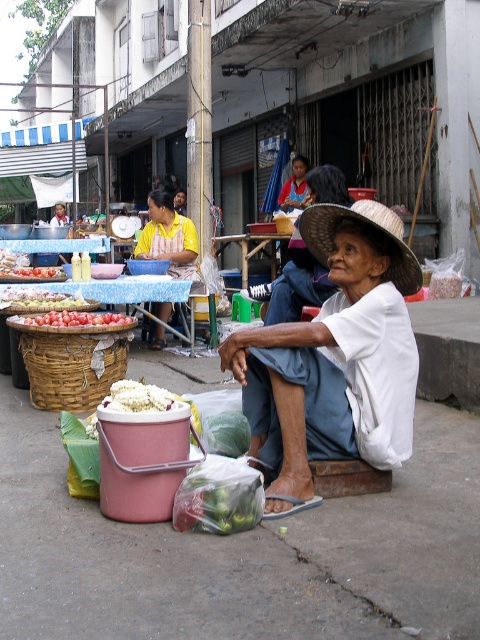
Question: Which of the following is the farthest from the observer?

Choices:
 (A) white cotton hat at center
 (B) woven brown basket at lower left
 (C) strawmaterial/texturehat at center

Answer: (B)

Question: Considering the real-world distances, which object is closest to the strawmaterial/texturehat at center?

Choices:
 (A) yellow fabric apron at center
 (B) pink plastic bucket at lower center
 (C) woven brown basket at lower left

Answer: (B)

Question: Which of the following is the farthest from the observer?

Choices:
 (A) (79, 404)
 (B) (343, 333)
 (C) (148, 209)
 (D) (400, 240)

Answer: (C)

Question: Does white cotton hat at center have a smaller size compared to strawmaterial/texturehat at center?

Choices:
 (A) yes
 (B) no

Answer: (B)

Question: Is white cotton hat at center to the left of woven brown basket at lower left from the viewer's perspective?

Choices:
 (A) yes
 (B) no

Answer: (B)

Question: Can you confirm if woven brown basket at lower left is positioned to the right of red glossy tomatoes at center?

Choices:
 (A) yes
 (B) no

Answer: (A)